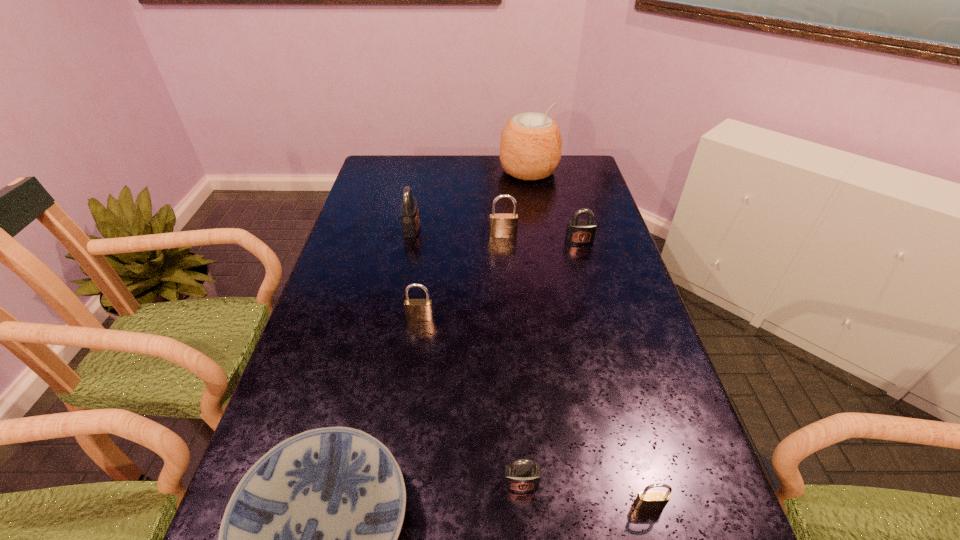
Identify the location of the second nearest padlock. The width and height of the screenshot is (960, 540). (522, 475).

Locate an element on the screen. This screenshot has height=540, width=960. the rightmost brass padlock is located at coordinates (647, 500).

Find the location of a particular element. The height and width of the screenshot is (540, 960). the nearest padlock is located at coordinates (647, 500).

Where is `free spot located 0.270m on the left of the tallest object`? The height and width of the screenshot is (540, 960). free spot located 0.270m on the left of the tallest object is located at coordinates (430, 171).

At what (x,y) coordinates should I click in order to perform the action: click on vacant space located 0.260m on the front of the leftmost padlock near the keyhole. Please return your answer as a coordinate pair (x, y). The image size is (960, 540). Looking at the image, I should click on (500, 228).

This screenshot has height=540, width=960. Find the location of `vacant space situated on the front-facing side of the second brass padlock from left to right`. vacant space situated on the front-facing side of the second brass padlock from left to right is located at coordinates (507, 292).

Identify the location of vacant space located 0.110m on the front of the rightmost gray padlock near the keyhole. (587, 268).

In order to click on blank space located 0.160m on the front-facing side of the fifth padlock from right to left in this screenshot , I will do `click(413, 372)`.

I want to click on object present at the far edge, so click(x=530, y=148).

Where is `coconut positioned at the right edge`? This screenshot has width=960, height=540. coconut positioned at the right edge is located at coordinates (530, 148).